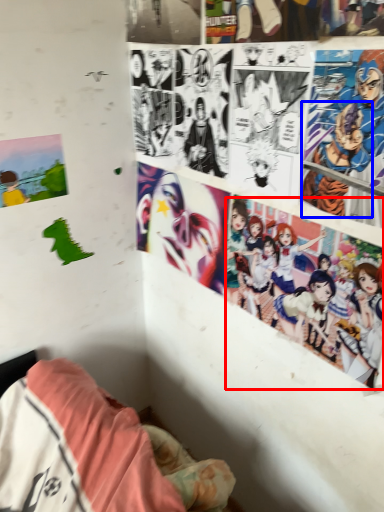
Question: Which object is closer to the camera taking this photo, person (highlighted by a red box) or person (highlighted by a blue box)?

Choices:
 (A) person
 (B) person

Answer: (B)